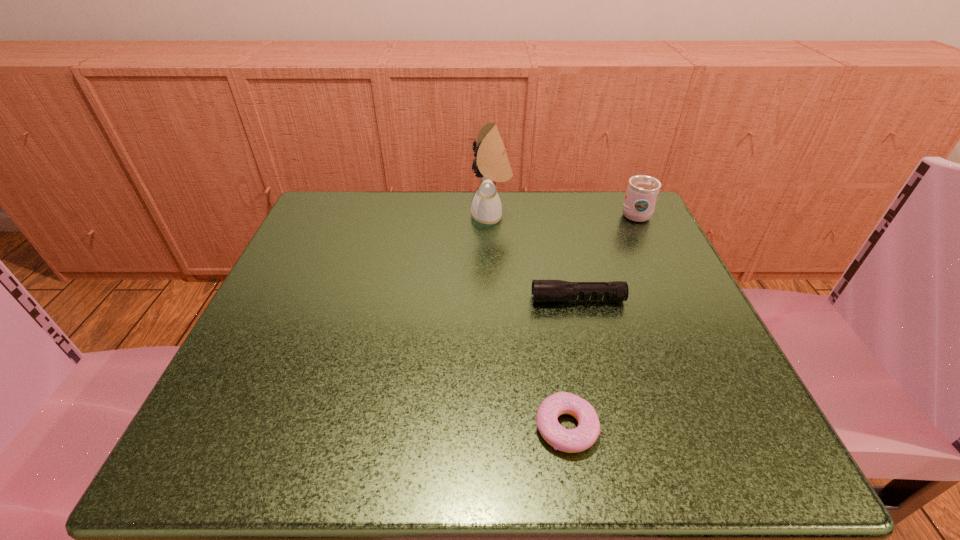
This screenshot has height=540, width=960. I want to click on vacant space located 0.200m at the front face of the doll, so click(x=380, y=217).

Identify the location of vacant area situated on the side with the handle of the third shortest object. (624, 191).

Locate an element on the screen. The image size is (960, 540). vacant space situated at the lens end of the third farthest object is located at coordinates (408, 300).

This screenshot has height=540, width=960. In order to click on blank space located 0.360m at the lens end of the third farthest object in this screenshot , I will do `click(328, 300)`.

Find the location of a particular element. The height and width of the screenshot is (540, 960). vacant space situated 0.400m at the lens end of the third farthest object is located at coordinates (306, 300).

This screenshot has height=540, width=960. I want to click on vacant space located on the right of the doughnut, so click(x=685, y=428).

In order to click on doll that is at the far edge in this screenshot , I will do `click(493, 166)`.

Locate an element on the screen. The width and height of the screenshot is (960, 540). cup situated at the far edge is located at coordinates (642, 191).

Where is `object at the near edge`? object at the near edge is located at coordinates (579, 439).

The height and width of the screenshot is (540, 960). I want to click on cup at the right edge, so click(x=642, y=191).